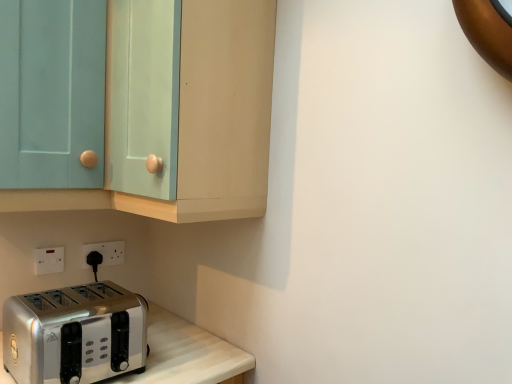
Question: From the image's perspective, is satin silver toaster at lower left positioned above or below light blue glass door at upper left?

Choices:
 (A) above
 (B) below

Answer: (B)

Question: Relative to light blue glass door at upper left, is satin silver toaster at lower left in front or behind?

Choices:
 (A) behind
 (B) front

Answer: (B)

Question: Which is nearer to the matte teal cabinet at upper left?

Choices:
 (A) satin silver toaster at lower left
 (B) light blue glass door at upper left
 (C) white plastic electric outlet at lower left, the second electric outlet positioned from the back
 (D) white plastic electric outlet at lower left, which is the first electric outlet in back-to-front order

Answer: (B)

Question: Which is nearer to the satin silver toaster at lower left?

Choices:
 (A) white plastic electric outlet at lower left, the 1th electric outlet when ordered from front to back
 (B) light blue glass door at upper left
 (C) matte teal cabinet at upper left
 (D) white plastic electric outlet at lower left, marked as the 2th electric outlet in a left-to-right arrangement

Answer: (A)